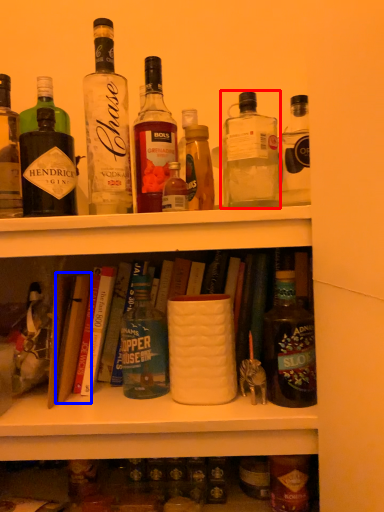
Question: Which object appears farthest to the camera in this image, bottle (highlighted by a red box) or book (highlighted by a blue box)?

Choices:
 (A) bottle
 (B) book

Answer: (B)